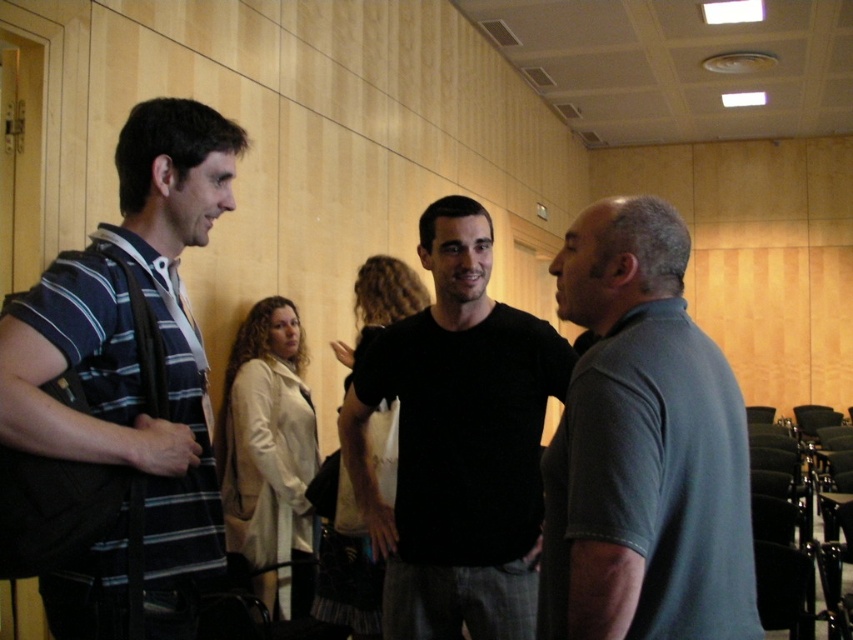
Based on the scene described, where exactly is the gray cotton polo shirt at right located in the image?

The gray cotton polo shirt at right is located at point 0.702 on the x axis and 0.755 on the y axis.

You are organizing a photo shoot and need to arrange the gray cotton polo shirt at right and the black matte shirt at center in a display case. The display case has limited space. Which shirt should you choose to ensure it fits comfortably without overcrowding the display?

The gray cotton polo shirt at right occupies less space than the black matte shirt at center, so it would fit comfortably in the display case without overcrowding.